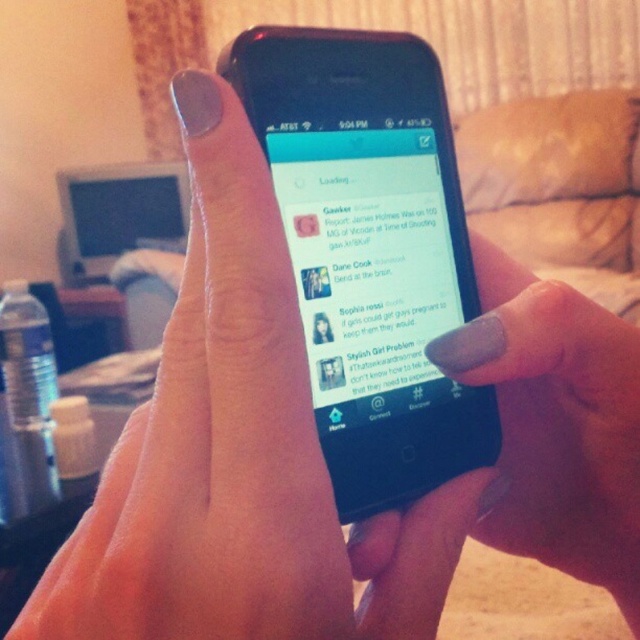
Does nail polish at center appear on the left side of matte gray nail polish at center?

Correct, you'll find nail polish at center to the left of matte gray nail polish at center.

Can you confirm if nail polish at center is positioned to the right of matte gray nail polish at center?

Incorrect, nail polish at center is not on the right side of matte gray nail polish at center.

This screenshot has height=640, width=640. Find the location of `nail polish at center`. nail polish at center is located at coordinates (240, 456).

Who is higher up, matte black phone at center or matte gray nail polish at center?

matte black phone at center is higher up.

Can you confirm if matte black phone at center is bigger than matte gray nail polish at center?

Incorrect, matte black phone at center is not larger than matte gray nail polish at center.

Locate an element on the screen. matte black phone at center is located at coordinates [372, 264].

Is nail polish at center positioned at the back of matte black phone at center?

No, it is not.

Who is more forward, (228, 412) or (388, 365)?

Positioned in front is point (228, 412).

Which is in front, point (252, 224) or point (296, 200)?

Point (252, 224) is more forward.

This screenshot has height=640, width=640. In order to click on nail polish at center in this screenshot , I will do `click(240, 456)`.